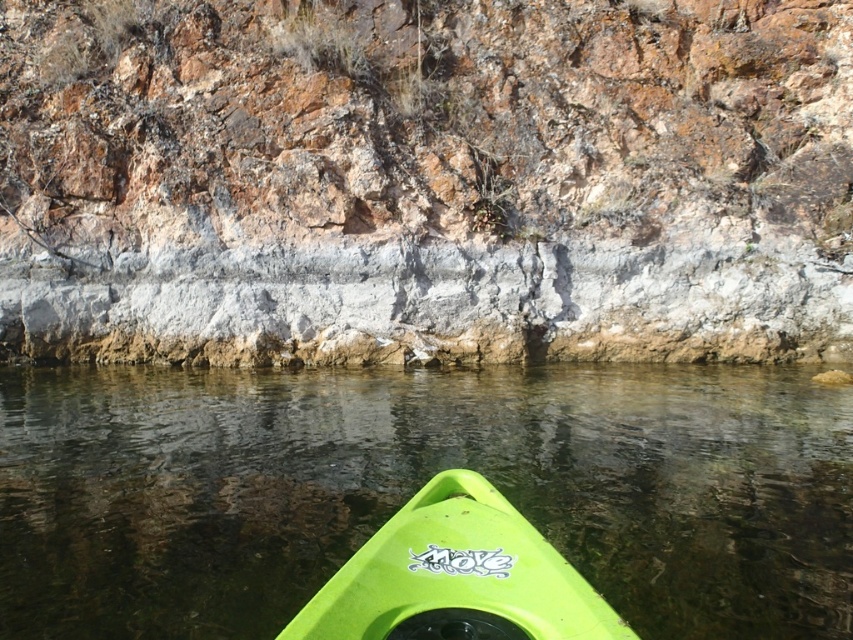
You are standing on a rocky cliff and see the green plastic kayak at lower center in the water below. If you want to throw a small stone to hit the kayak, what is the minimum distance you need to throw it?

The minimum distance you need to throw the stone is 5.17 meters, as the green plastic kayak at lower center and viewer are 5.17 meters apart.

You are in a kayak and want to approach the cliff for a closer look. Given that your kayak can safely maneuver within 50 feet of a rocky surface, is the distance between the green matte kayak at lower center and the rusty rock cliff at center safe for your current position?

The rusty rock cliff at center is 53.22 feet away from the green matte kayak at lower center. Since the safe maneuvering distance is 50 feet, the current distance exceeds the safe limit, so it is not safe to approach further without adjusting your position.

You are in a kayak and want to measure the distance to the rusty rock cliff at center. Your GPS shows that you are 60 feet away from it. Is your GPS accurate?

The rusty rock cliff at center is 62.04 feet away from viewer, so the GPS reading of 60 feet is inaccurate by approximately 2.04 feet.